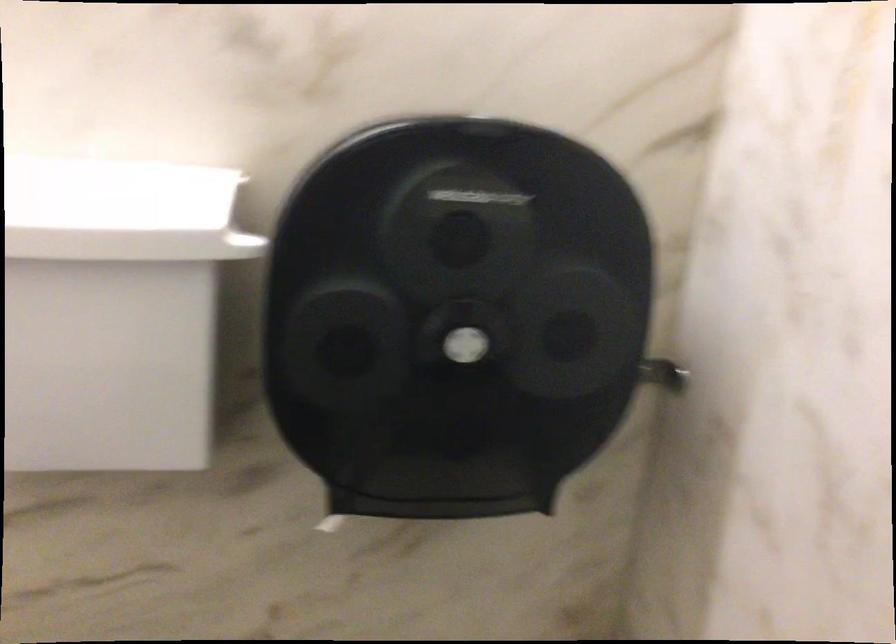
Where is `silver push-button lock`? This screenshot has height=644, width=896. silver push-button lock is located at coordinates (461, 341).